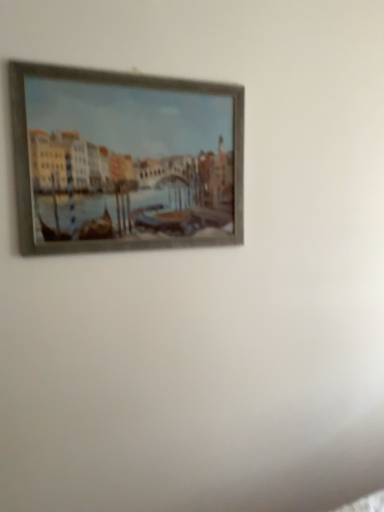
This screenshot has height=512, width=384. Describe the element at coordinates (124, 160) in the screenshot. I see `wooden frame painting at upper center` at that location.

This screenshot has width=384, height=512. In order to click on wooden frame painting at upper center in this screenshot , I will do `click(124, 160)`.

Where is `wooden frame painting at upper center`? Image resolution: width=384 pixels, height=512 pixels. wooden frame painting at upper center is located at coordinates (124, 160).